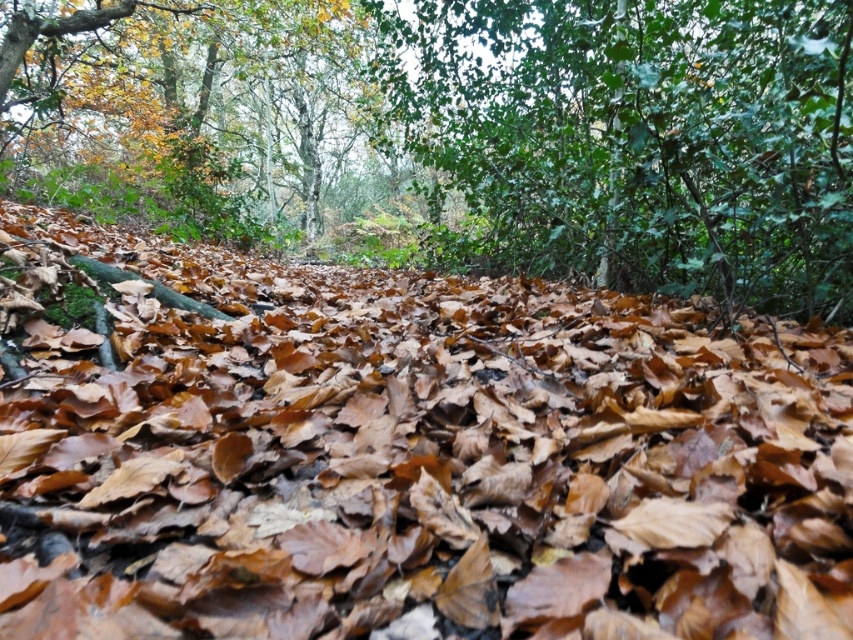
Question: Which point appears farthest from the camera in this image?

Choices:
 (A) (x=599, y=156)
 (B) (x=463, y=573)

Answer: (A)

Question: Is the position of brown leaf litter at center less distant than that of green glossy leaves at upper center?

Choices:
 (A) no
 (B) yes

Answer: (B)

Question: Does brown leaf litter at center appear under green glossy leaves at upper center?

Choices:
 (A) yes
 (B) no

Answer: (A)

Question: Does brown leaf litter at center appear over green glossy leaves at upper center?

Choices:
 (A) no
 (B) yes

Answer: (A)

Question: Which of the following is the closest to the observer?

Choices:
 (A) (244, 476)
 (B) (575, 1)

Answer: (A)